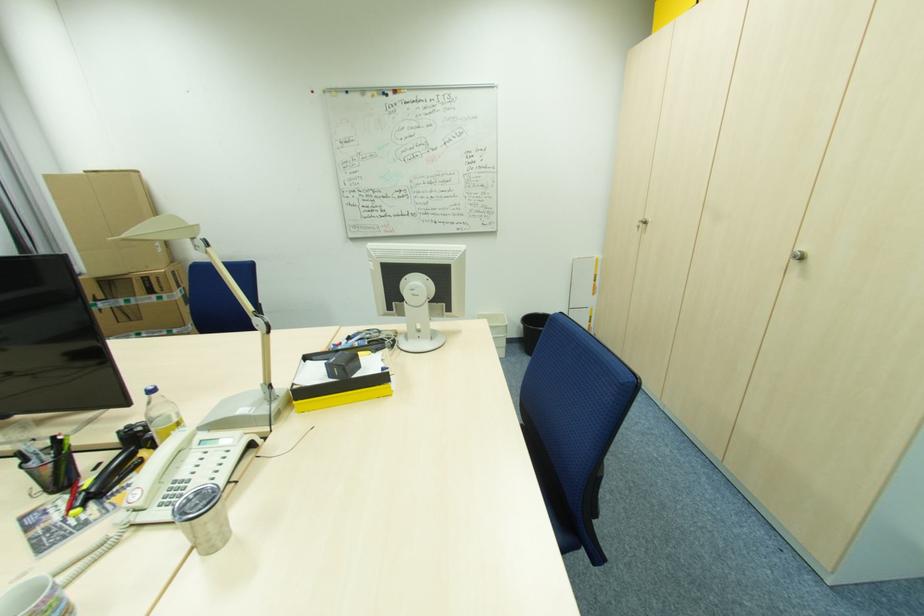
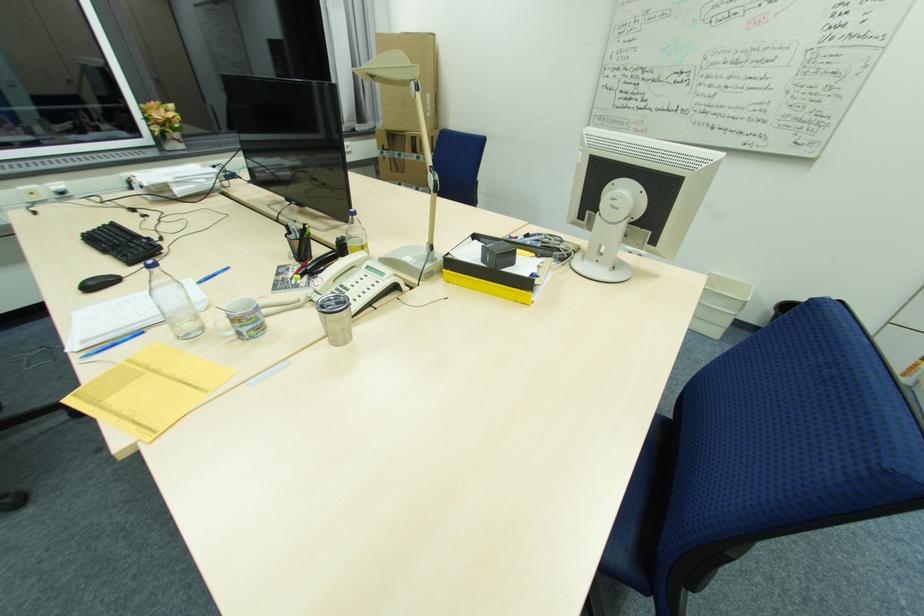
The point at [332,378] is marked in the first image. Where is the corresponding point in the second image?

(484, 262)